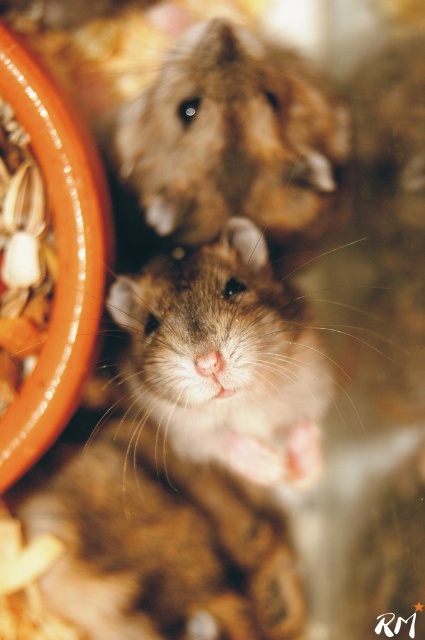
Question: Is fuzzy brown hamster at center thinner than fuzzy brown hamster at upper center?

Choices:
 (A) no
 (B) yes

Answer: (A)

Question: Which of the following is the farthest from the observer?

Choices:
 (A) fuzzy brown hamster at upper center
 (B) fuzzy brown hamster at center

Answer: (A)

Question: Can you confirm if fuzzy brown hamster at center is bigger than fuzzy brown hamster at upper center?

Choices:
 (A) yes
 (B) no

Answer: (A)

Question: Where is fuzzy brown hamster at center located in relation to fuzzy brown hamster at upper center in the image?

Choices:
 (A) above
 (B) below

Answer: (B)